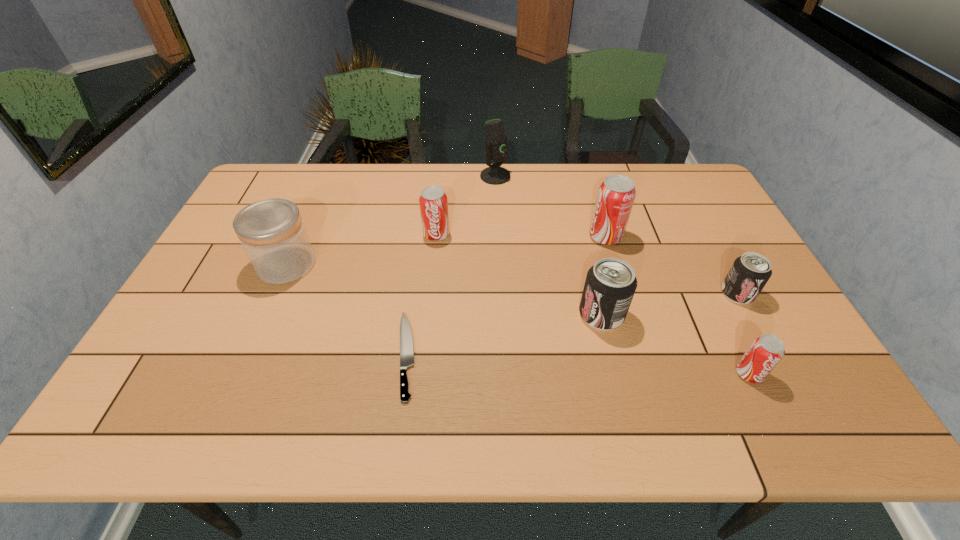
Locate an element on the screen. This screenshot has width=960, height=540. vacant space located on the logo side of the rightmost red soda can is located at coordinates (765, 406).

Identify the location of vacant area located on the right of the shortest object. Image resolution: width=960 pixels, height=540 pixels. (450, 355).

I want to click on object that is at the far edge, so click(x=496, y=149).

You are a GUI agent. You are given a task and a screenshot of the screen. Output one action in this format:
    pyautogui.click(x=<x>, y=<y>)
    Task: Click on the object present at the near edge
    The image size is (960, 540).
    Given the screenshot: What is the action you would take?
    pyautogui.click(x=406, y=341)

The width and height of the screenshot is (960, 540). In order to click on object that is at the left edge in this screenshot , I will do `click(272, 233)`.

Locate an element on the screen. vacant space at the far edge of the desktop is located at coordinates (427, 170).

Find the location of `vacant area at the near edge of the desktop`. vacant area at the near edge of the desktop is located at coordinates (636, 414).

Where is `vacant space at the left edge of the desktop`? vacant space at the left edge of the desktop is located at coordinates (205, 308).

Identify the location of vacant space at the right edge of the desktop. Image resolution: width=960 pixels, height=540 pixels. (747, 346).

Identify the location of vacant space at the far left corner of the desktop. (285, 187).